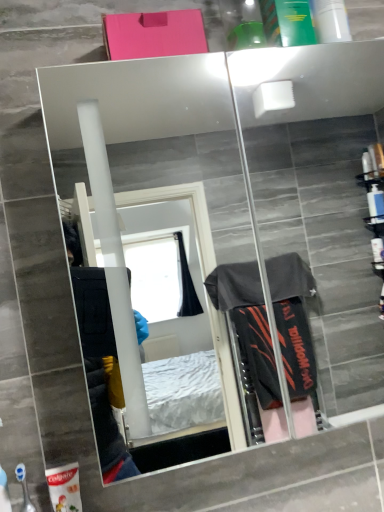
Question: Is blue plastic toothbrush at lower left, which is the 1th toiletry from front to back, facing towards mirror glass at upper center?

Choices:
 (A) no
 (B) yes

Answer: (A)

Question: From the image's perspective, would you say blue plastic toothbrush at lower left, which is the 1th toiletry from front to back, is shown under mirror glass at upper center?

Choices:
 (A) yes
 (B) no

Answer: (A)

Question: Does blue plastic toothbrush at lower left, positioned as the 2th toiletry in back-to-front order, appear on the right side of mirror glass at upper center?

Choices:
 (A) no
 (B) yes

Answer: (A)

Question: Is blue plastic toothbrush at lower left, which is the 1th toiletry from front to back, shorter than mirror glass at upper center?

Choices:
 (A) yes
 (B) no

Answer: (A)

Question: Can you confirm if blue plastic toothbrush at lower left, positioned as the 2th toiletry in back-to-front order, is thinner than mirror glass at upper center?

Choices:
 (A) yes
 (B) no

Answer: (A)

Question: Considering the relative sizes of blue plastic toothbrush at lower left, which is the 1th toiletry from front to back, and mirror glass at upper center in the image provided, is blue plastic toothbrush at lower left, which is the 1th toiletry from front to back, wider than mirror glass at upper center?

Choices:
 (A) yes
 (B) no

Answer: (B)

Question: Is blue plastic toothbrush at lower left, which is the 1th toiletry from front to back, in front of white matte toothpaste tube at lower left, arranged as the first toiletry when viewed from the back?

Choices:
 (A) yes
 (B) no

Answer: (A)

Question: From the image's perspective, does blue plastic toothbrush at lower left, positioned as the 2th toiletry in back-to-front order, appear higher than white matte toothpaste tube at lower left, arranged as the first toiletry when viewed from the back?

Choices:
 (A) no
 (B) yes

Answer: (B)

Question: Can you confirm if blue plastic toothbrush at lower left, which is the 1th toiletry from front to back, is bigger than white matte toothpaste tube at lower left, the second toiletry when ordered from front to back?

Choices:
 (A) no
 (B) yes

Answer: (A)

Question: From a real-world perspective, is blue plastic toothbrush at lower left, positioned as the 2th toiletry in back-to-front order, on white matte toothpaste tube at lower left, the second toiletry when ordered from front to back?

Choices:
 (A) no
 (B) yes

Answer: (B)

Question: Could you tell me if blue plastic toothbrush at lower left, positioned as the 2th toiletry in back-to-front order, is turned towards white matte toothpaste tube at lower left, arranged as the first toiletry when viewed from the back?

Choices:
 (A) yes
 (B) no

Answer: (B)

Question: From a real-world perspective, is blue plastic toothbrush at lower left, which is the 1th toiletry from front to back, below white matte toothpaste tube at lower left, arranged as the first toiletry when viewed from the back?

Choices:
 (A) no
 (B) yes

Answer: (A)

Question: Does mirror glass at upper center come behind white matte toothpaste tube at lower left, arranged as the first toiletry when viewed from the back?

Choices:
 (A) no
 (B) yes

Answer: (A)